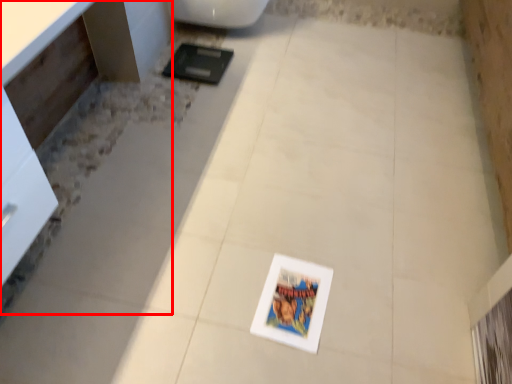
Question: Considering the relative positions of vanity (annotated by the red box) and toilet in the image provided, where is vanity (annotated by the red box) located with respect to the staircase?

Choices:
 (A) left
 (B) right

Answer: (A)